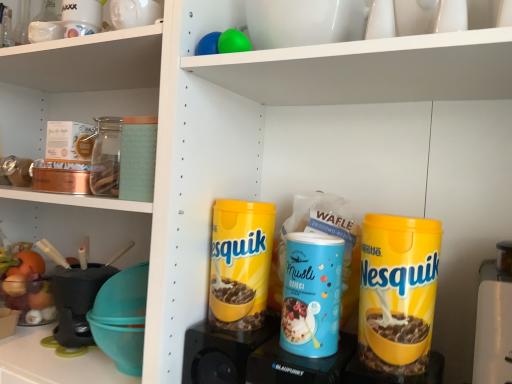
How much space does yellow plastic speaker at lower center, the first appliance positioned from the left, occupy vertically?

It is 5.99 inches.

Find the location of a particular element. The height and width of the screenshot is (384, 512). yellow plastic speaker at lower center, the first appliance positioned from the left is located at coordinates (222, 352).

At what (x,y) coordinates should I click in order to perform the action: click on yellow matte nesquik canister at center right, the first cereal viewed from the front. Please return your answer as a coordinate pair (x, y). Image resolution: width=512 pixels, height=384 pixels. Looking at the image, I should click on (398, 292).

The width and height of the screenshot is (512, 384). What do you see at coordinates (398, 292) in the screenshot?
I see `yellow matte nesquik canister at center right, the second cereal positioned from the left` at bounding box center [398, 292].

Describe the element at coordinates (312, 294) in the screenshot. The width and height of the screenshot is (512, 384). I see `blue matte musli at center` at that location.

I want to click on yellow plastic speaker at lower center, the first appliance positioned from the left, so click(x=222, y=352).

Can you confirm if blue matte musli at center is shorter than yellow matte nesquik canister at center, the second cereal from the right?

Yes.

From a real-world perspective, starting from the blue matte musli at center, which cereal is the 2nd one vertically above it? Please provide its 2D coordinates.

[(240, 263)]

Does point (288, 295) come in front of point (270, 261)?

Yes, it is.

Choose the correct answer: Is blue matte musli at center inside yellow matte nesquik canister at center, marked as the 1th cereal in a left-to-right arrangement, or outside it?

blue matte musli at center is not inside yellow matte nesquik canister at center, marked as the 1th cereal in a left-to-right arrangement, it's outside.

From the image's perspective, is blue matte musli at center on yellow plastic speaker at lower center, the first appliance positioned from the left?

Correct, blue matte musli at center appears higher than yellow plastic speaker at lower center, the first appliance positioned from the left, in the image.

How distant is blue matte musli at center from yellow plastic speaker at lower center, the 2th appliance from the right?

A distance of 6.13 inches exists between blue matte musli at center and yellow plastic speaker at lower center, the 2th appliance from the right.

Is blue matte musli at center in contact with yellow plastic speaker at lower center, the 2th appliance from the right?

blue matte musli at center is not next to yellow plastic speaker at lower center, the 2th appliance from the right, and they're not touching.

Which of these two, blue matte musli at center or yellow plastic speaker at lower center, the first appliance positioned from the left, is wider?

With larger width is yellow plastic speaker at lower center, the first appliance positioned from the left.

Could you tell me if yellow matte nesquik canister at center right, the second cereal positioned from the left, is turned towards blue matte musli at center?

No, yellow matte nesquik canister at center right, the second cereal positioned from the left, is not facing towards blue matte musli at center.

Is yellow matte nesquik canister at center right, the first cereal viewed from the front, not inside blue matte musli at center?

Yes.

The height and width of the screenshot is (384, 512). I want to click on the 1st cereal positioned above the blue matte musli at center (from the image's perspective), so click(x=398, y=292).

Can you confirm if yellow matte nesquik canister at center right, marked as the 1th cereal in a right-to-left arrangement, is taller than blue matte musli at center?

Yes, yellow matte nesquik canister at center right, marked as the 1th cereal in a right-to-left arrangement, is taller than blue matte musli at center.

Which object is wider, blue plastic container at center, which ranks as the 2th appliance in left-to-right order, or yellow matte nesquik canister at center right, the first cereal viewed from the front?

blue plastic container at center, which ranks as the 2th appliance in left-to-right order.

Who is taller, blue plastic container at center, which ranks as the 2th appliance in left-to-right order, or yellow matte nesquik canister at center right, marked as the 1th cereal in a right-to-left arrangement?

yellow matte nesquik canister at center right, marked as the 1th cereal in a right-to-left arrangement.

Is point (254, 374) farther from viewer compared to point (420, 251)?

Yes.

Is blue plastic container at center, marked as the first appliance in a right-to-left arrangement, oriented towards yellow matte nesquik canister at center right, the second cereal positioned from the left?

No, blue plastic container at center, marked as the first appliance in a right-to-left arrangement, is not aimed at yellow matte nesquik canister at center right, the second cereal positioned from the left.

Is blue plastic container at center, marked as the first appliance in a right-to-left arrangement, surrounding yellow matte nesquik canister at center, which ranks as the 1th cereal in back-to-front order?

No, yellow matte nesquik canister at center, which ranks as the 1th cereal in back-to-front order, is not surrounded by blue plastic container at center, marked as the first appliance in a right-to-left arrangement.

From a real-world perspective, relative to yellow matte nesquik canister at center, marked as the 1th cereal in a left-to-right arrangement, is blue plastic container at center, which ranks as the 2th appliance in left-to-right order, vertically above or below?

Clearly, from a real-world perspective, blue plastic container at center, which ranks as the 2th appliance in left-to-right order, is below yellow matte nesquik canister at center, marked as the 1th cereal in a left-to-right arrangement.

Who is shorter, blue plastic container at center, which ranks as the 2th appliance in left-to-right order, or yellow matte nesquik canister at center, marked as the 2th cereal in a front-to-back arrangement?

blue plastic container at center, which ranks as the 2th appliance in left-to-right order.

What's the angular difference between yellow plastic speaker at lower center, the first appliance positioned from the left, and blue matte musli at center's facing directions?

yellow plastic speaker at lower center, the first appliance positioned from the left, and blue matte musli at center are facing 0.00323 degrees away from each other.

Between yellow plastic speaker at lower center, the first appliance positioned from the left, and blue matte musli at center, which one appears on the right side from the viewer's perspective?

blue matte musli at center is more to the right.

From a real-world perspective, who is located lower, yellow plastic speaker at lower center, the first appliance positioned from the left, or blue matte musli at center?

yellow plastic speaker at lower center, the first appliance positioned from the left.

Is yellow plastic speaker at lower center, the 2th appliance from the right, not near blue matte musli at center?

They are positioned close to each other.

Is blue matte musli at center in front of or behind blue plastic container at center, marked as the first appliance in a right-to-left arrangement, in the image?

Visually, blue matte musli at center is located behind blue plastic container at center, marked as the first appliance in a right-to-left arrangement.

Which point is more forward, (292, 349) or (274, 378)?

The point (292, 349) is closer to the camera.

Is blue plastic container at center, which ranks as the 2th appliance in left-to-right order, completely or partially inside blue matte musli at center?

That's incorrect, blue plastic container at center, which ranks as the 2th appliance in left-to-right order, is not inside blue matte musli at center.

The image size is (512, 384). I want to click on cereal that is the 2nd one above the blue matte musli at center (from a real-world perspective), so click(x=240, y=263).

This screenshot has width=512, height=384. Find the location of `product in front of the yellow plastic speaker at lower center, the first appliance positioned from the left`. product in front of the yellow plastic speaker at lower center, the first appliance positioned from the left is located at coordinates (312, 294).

Looking at the image, which one is located closer to yellow matte nesquik canister at center right, which ranks as the 2th cereal in back-to-front order, yellow matte nesquik canister at center, marked as the 1th cereal in a left-to-right arrangement, or yellow plastic speaker at lower center, the 2th appliance from the right?

yellow matte nesquik canister at center, marked as the 1th cereal in a left-to-right arrangement.

Looking at the image, which one is located further to yellow matte nesquik canister at center right, marked as the 1th cereal in a right-to-left arrangement, yellow plastic speaker at lower center, the first appliance positioned from the left, or blue matte musli at center?

The object further to yellow matte nesquik canister at center right, marked as the 1th cereal in a right-to-left arrangement, is yellow plastic speaker at lower center, the first appliance positioned from the left.

Estimate the real-world distances between objects in this image. Which object is further from yellow plastic speaker at lower center, the first appliance positioned from the left, yellow matte nesquik canister at center right, which ranks as the 2th cereal in back-to-front order, or yellow matte nesquik canister at center, marked as the 1th cereal in a left-to-right arrangement?

yellow matte nesquik canister at center right, which ranks as the 2th cereal in back-to-front order, lies further to yellow plastic speaker at lower center, the first appliance positioned from the left, than the other object.

Based on their spatial positions, is blue matte musli at center or yellow matte nesquik canister at center right, the second cereal positioned from the left, closer to yellow plastic speaker at lower center, the 2th appliance from the right?

Based on the image, blue matte musli at center appears to be nearer to yellow plastic speaker at lower center, the 2th appliance from the right.

Looking at the image, which one is located closer to yellow matte nesquik canister at center right, which ranks as the 2th cereal in back-to-front order, yellow plastic speaker at lower center, the first appliance positioned from the left, or blue plastic container at center, which ranks as the 2th appliance in left-to-right order?

blue plastic container at center, which ranks as the 2th appliance in left-to-right order, is closer to yellow matte nesquik canister at center right, which ranks as the 2th cereal in back-to-front order.

Considering their positions, is yellow matte nesquik canister at center right, which ranks as the 2th cereal in back-to-front order, positioned further to blue plastic container at center, marked as the first appliance in a right-to-left arrangement, than yellow matte nesquik canister at center, marked as the 1th cereal in a left-to-right arrangement?

yellow matte nesquik canister at center right, which ranks as the 2th cereal in back-to-front order, is further to blue plastic container at center, marked as the first appliance in a right-to-left arrangement.

Considering their positions, is yellow matte nesquik canister at center right, the first cereal viewed from the front, positioned closer to yellow plastic speaker at lower center, the first appliance positioned from the left, than blue matte musli at center?

blue matte musli at center.

From the image, which object appears to be farther from blue plastic container at center, which ranks as the 2th appliance in left-to-right order, yellow matte nesquik canister at center, which ranks as the 1th cereal in back-to-front order, or yellow matte nesquik canister at center right, marked as the 1th cereal in a right-to-left arrangement?

yellow matte nesquik canister at center right, marked as the 1th cereal in a right-to-left arrangement, lies further to blue plastic container at center, which ranks as the 2th appliance in left-to-right order, than the other object.

The image size is (512, 384). Find the location of `appliance between yellow matte nesquik canister at center, marked as the 1th cereal in a left-to-right arrangement, and blue plastic container at center, which ranks as the 2th appliance in left-to-right order, from top to bottom`. appliance between yellow matte nesquik canister at center, marked as the 1th cereal in a left-to-right arrangement, and blue plastic container at center, which ranks as the 2th appliance in left-to-right order, from top to bottom is located at coordinates (222, 352).

You are a GUI agent. You are given a task and a screenshot of the screen. Output one action in this format:
    pyautogui.click(x=<x>, y=<y>)
    Task: Click on the product between yellow matte nesquik canister at center, the second cereal from the right, and blue plastic container at center, which ranks as the 2th appliance in left-to-right order, from top to bottom
    
    Given the screenshot: What is the action you would take?
    pyautogui.click(x=312, y=294)

Locate an element on the screen. appliance that lies between blue matte musli at center and blue plastic container at center, marked as the first appliance in a right-to-left arrangement, from top to bottom is located at coordinates (222, 352).

The image size is (512, 384). I want to click on product situated between yellow matte nesquik canister at center, marked as the 2th cereal in a front-to-back arrangement, and yellow matte nesquik canister at center right, the second cereal positioned from the left, from left to right, so click(x=312, y=294).